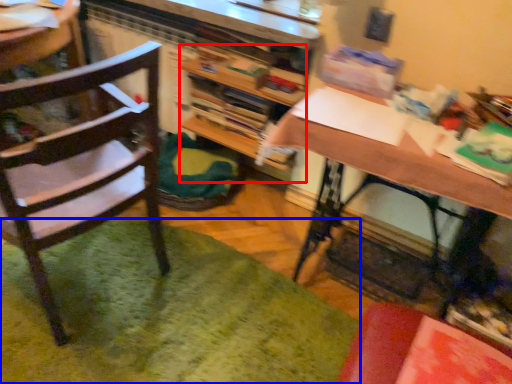
Question: Which of the following is the farthest to the observer, bookshelf (highlighted by a red box) or mat (highlighted by a blue box)?

Choices:
 (A) bookshelf
 (B) mat

Answer: (A)